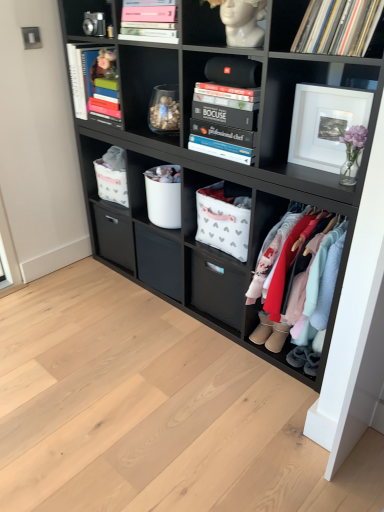
Question: Should I look upward or downward to see pink matte book at upper center, positioned as the 1th magazine in front-to-back order?

Choices:
 (A) down
 (B) up

Answer: (B)

Question: Is hardcover book at upper left, which ranks as the 2th magazine in front-to-back order, in contact with metallic silver camera at upper left?

Choices:
 (A) no
 (B) yes

Answer: (A)

Question: Can you confirm if hardcover book at upper left, the second magazine positioned from the right, is wider than metallic silver camera at upper left?

Choices:
 (A) no
 (B) yes

Answer: (B)

Question: Is hardcover book at upper left, which ranks as the 2th magazine in front-to-back order, smaller than metallic silver camera at upper left?

Choices:
 (A) no
 (B) yes

Answer: (A)

Question: Considering the relative sizes of hardcover book at upper left, which is the 1th magazine in back-to-front order, and metallic silver camera at upper left in the image provided, is hardcover book at upper left, which is the 1th magazine in back-to-front order, taller than metallic silver camera at upper left?

Choices:
 (A) yes
 (B) no

Answer: (A)

Question: Does hardcover book at upper left, which is the 1th magazine in back-to-front order, lie behind metallic silver camera at upper left?

Choices:
 (A) no
 (B) yes

Answer: (B)

Question: From a real-world perspective, is hardcover book at upper left, the second magazine positioned from the right, located higher than metallic silver camera at upper left?

Choices:
 (A) no
 (B) yes

Answer: (A)

Question: From the image's perspective, would you say white fabric storage bin at center, marked as the third shelf in a top-to-bottom arrangement, is shown under white fabric basket at center, marked as the fourth shelf in a top-to-bottom arrangement?

Choices:
 (A) yes
 (B) no

Answer: (B)

Question: Is white fabric storage bin at center, marked as the third shelf in a top-to-bottom arrangement, located outside white fabric basket at center, placed as the 3th shelf when sorted from bottom to top?

Choices:
 (A) no
 (B) yes

Answer: (B)

Question: Is white fabric storage bin at center, which appears as the fourth shelf when ordered from the bottom, positioned in front of white fabric basket at center, placed as the 3th shelf when sorted from bottom to top?

Choices:
 (A) no
 (B) yes

Answer: (B)

Question: Can you confirm if white fabric storage bin at center, marked as the third shelf in a top-to-bottom arrangement, is smaller than white fabric basket at center, marked as the fourth shelf in a top-to-bottom arrangement?

Choices:
 (A) yes
 (B) no

Answer: (B)

Question: Considering the relative sizes of white fabric storage bin at center, which appears as the fourth shelf when ordered from the bottom, and white fabric basket at center, marked as the fourth shelf in a top-to-bottom arrangement, in the image provided, is white fabric storage bin at center, which appears as the fourth shelf when ordered from the bottom, bigger than white fabric basket at center, marked as the fourth shelf in a top-to-bottom arrangement,?

Choices:
 (A) no
 (B) yes

Answer: (B)

Question: Does white fabric storage bin at center, which appears as the fourth shelf when ordered from the bottom, have a greater height compared to white fabric basket at center, marked as the fourth shelf in a top-to-bottom arrangement?

Choices:
 (A) yes
 (B) no

Answer: (A)

Question: Can you confirm if white fabric basket at center, placed as the 3th shelf when sorted from bottom to top, is taller than black hardcover books at center, the 2th shelf in the top-to-bottom sequence?

Choices:
 (A) yes
 (B) no

Answer: (A)